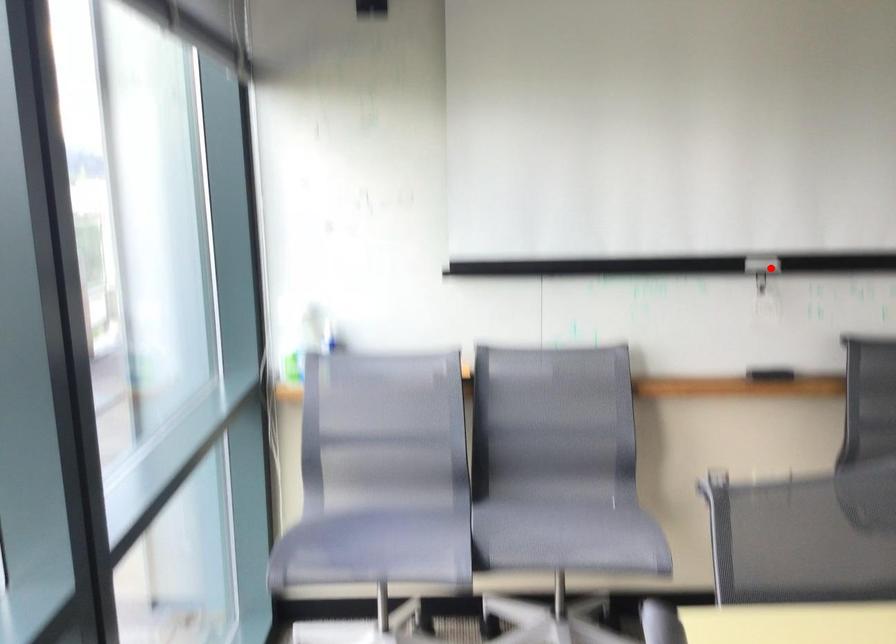
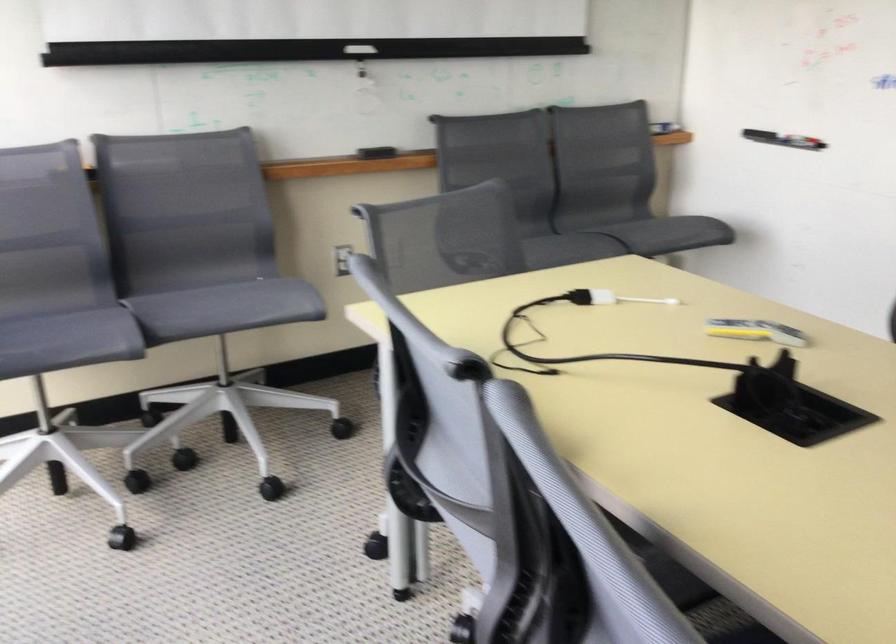
The point at the highlighted location is marked in the first image. Where is the corresponding point in the second image?

(359, 49)